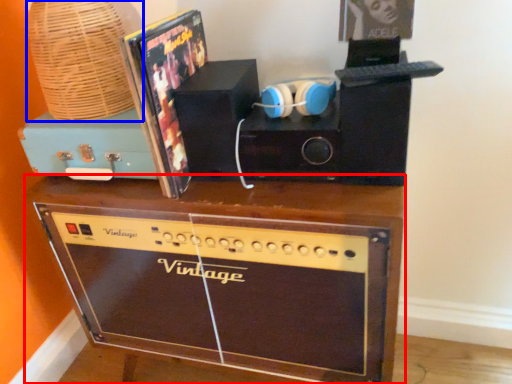
Question: Which point is closer to the camera, furniture (highlighted by a red box) or basket (highlighted by a blue box)?

Choices:
 (A) furniture
 (B) basket

Answer: (A)